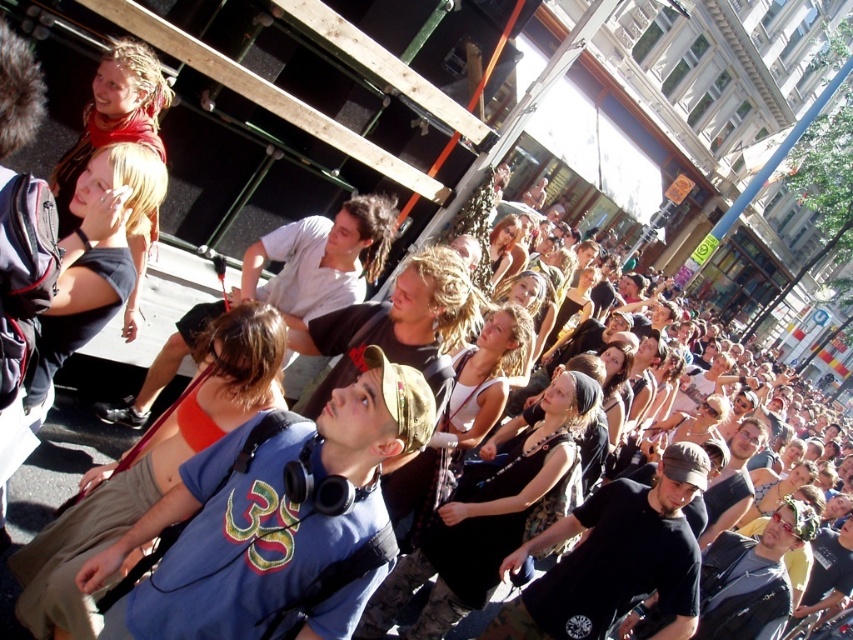
Between black matte t-shirt at center and matte white shirt at center, which one has more height?

black matte t-shirt at center is taller.

Between black matte t-shirt at center and matte white shirt at center, which one appears on the left side from the viewer's perspective?

matte white shirt at center

Describe the element at coordinates (614, 557) in the screenshot. Image resolution: width=853 pixels, height=640 pixels. I see `black matte t-shirt at center` at that location.

Image resolution: width=853 pixels, height=640 pixels. I want to click on black matte t-shirt at center, so click(614, 557).

Who is positioned more to the right, blue fabric shirt at center or black matte t-shirt at center?

Positioned to the right is black matte t-shirt at center.

At what (x,y) coordinates should I click in order to perform the action: click on blue fabric shirt at center. Please return your answer as a coordinate pair (x, y). The width and height of the screenshot is (853, 640). Looking at the image, I should click on coord(264,515).

Who is positioned more to the left, blue fabric shirt at center or matte white shirt at center?

matte white shirt at center is more to the left.

Does point (161, 616) come closer to viewer compared to point (131, 397)?

Yes, it is.

Is point (189, 547) farther from camera compared to point (300, 304)?

No.

Where is `blue fabric shirt at center`? The height and width of the screenshot is (640, 853). blue fabric shirt at center is located at coordinates (264, 515).